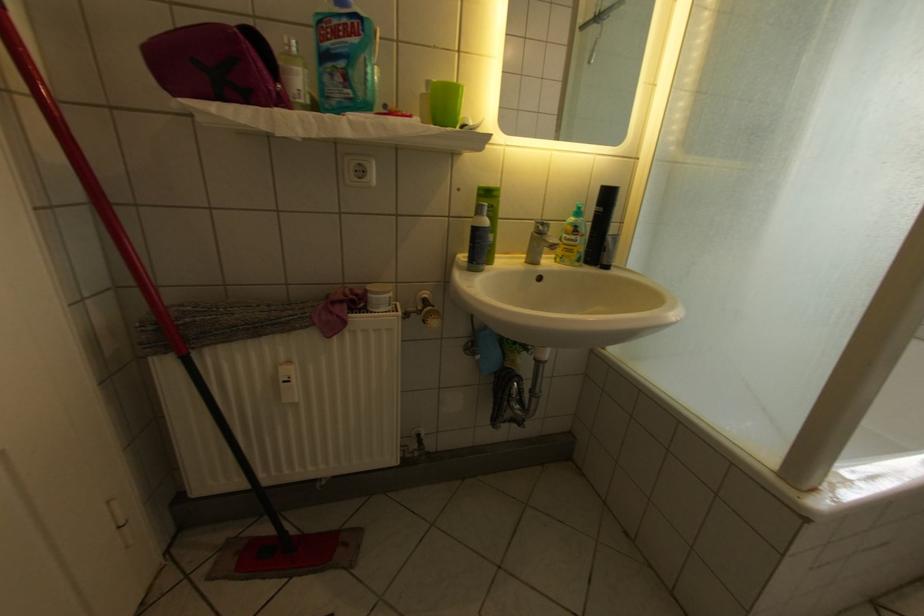
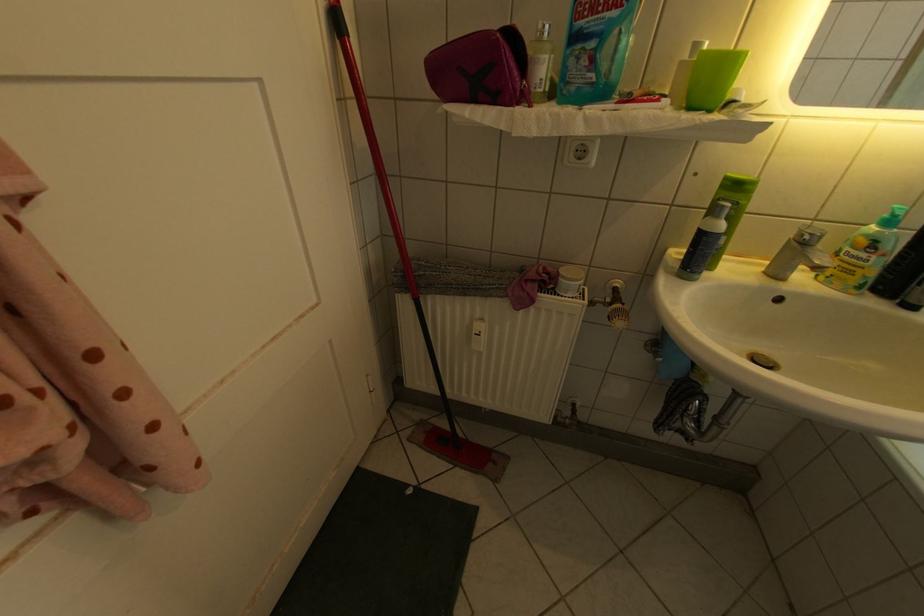
Where in the second image is the point corresponding to (x=287, y=107) from the first image?

(530, 105)